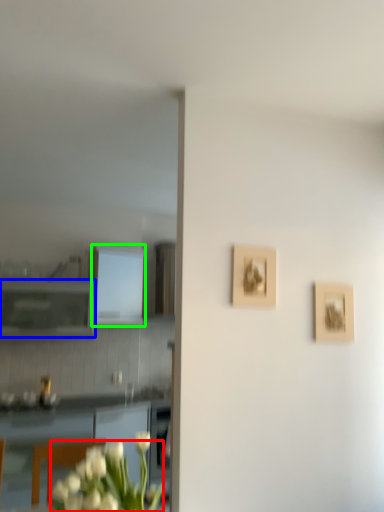
Question: Based on their relative distances, which object is farther from flower (highlighted by a red box)? Choose from cabinetry (highlighted by a blue box) and cabinetry (highlighted by a green box).

Choices:
 (A) cabinetry
 (B) cabinetry

Answer: (B)